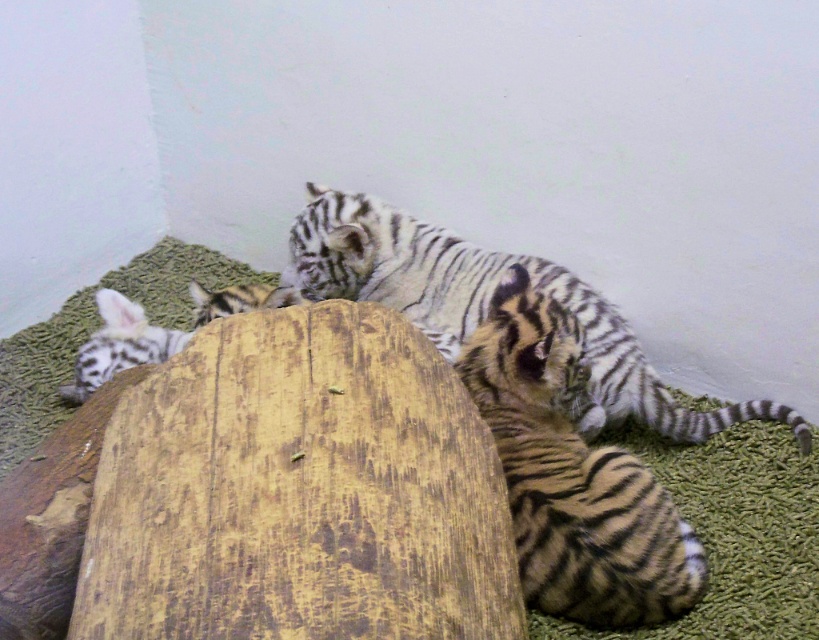
Question: Can you confirm if striped fur tiger at center is positioned to the right of striped fur tiger at lower left?

Choices:
 (A) yes
 (B) no

Answer: (A)

Question: Which point appears closest to the camera in this image?

Choices:
 (A) (514, 388)
 (B) (435, 241)
 (C) (139, 316)

Answer: (A)

Question: Which object is closer to the camera taking this photo?

Choices:
 (A) striped fur tiger at center
 (B) striped fur tiger at lower left
 (C) striped fur tiger at lower right

Answer: (C)

Question: Does striped fur tiger at lower right appear on the right side of striped fur tiger at lower left?

Choices:
 (A) no
 (B) yes

Answer: (B)

Question: Does striped fur tiger at lower right appear on the right side of striped fur tiger at lower left?

Choices:
 (A) yes
 (B) no

Answer: (A)

Question: Which is farther from the striped fur tiger at center?

Choices:
 (A) striped fur tiger at lower left
 (B) striped fur tiger at lower right

Answer: (A)